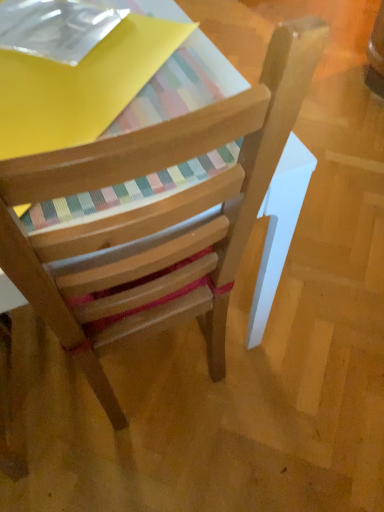
Locate an element on the screen. Image resolution: width=384 pixels, height=512 pixels. vacant point to the right of wooden chair at center is located at coordinates (316, 316).